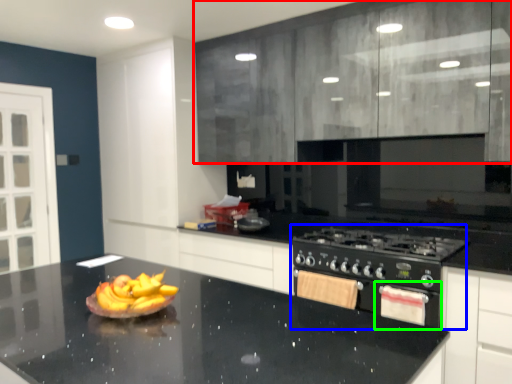
Question: Based on their relative distances, which object is farther from cabinetry (highlighted by a red box)? Choose from appliance (highlighted by a blue box) and oven (highlighted by a green box).

Choices:
 (A) appliance
 (B) oven

Answer: (B)